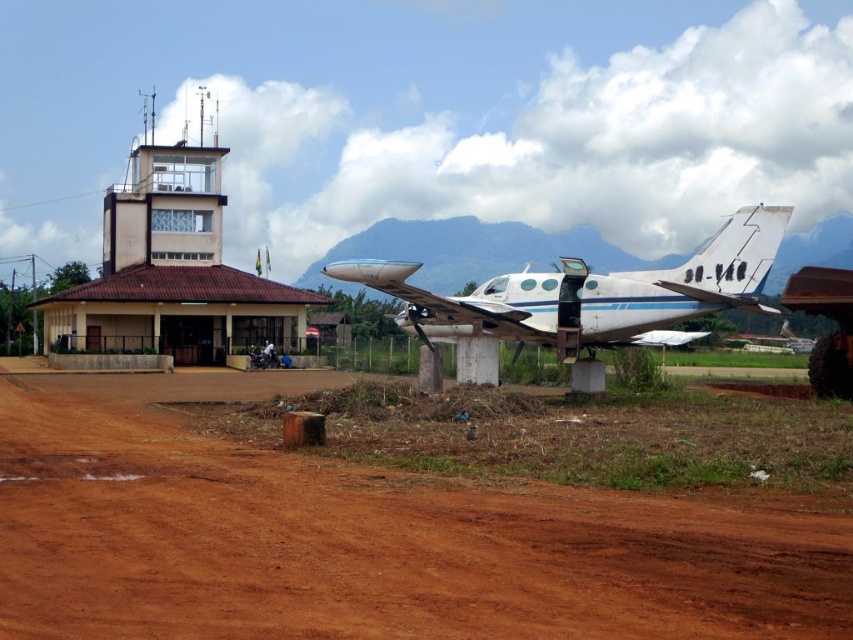
Question: Is brown dirt field at lower center positioned at the back of white matte airplane at center?

Choices:
 (A) yes
 (B) no

Answer: (B)

Question: Considering the relative positions of brown dirt field at lower center and white matte airplane at center in the image provided, where is brown dirt field at lower center located with respect to white matte airplane at center?

Choices:
 (A) below
 (B) above

Answer: (A)

Question: Which object is farther from the camera taking this photo?

Choices:
 (A) brown dirt field at lower center
 (B) white matte airplane at center

Answer: (B)

Question: Which point is closer to the camera taking this photo?

Choices:
 (A) (323, 625)
 (B) (757, 221)

Answer: (A)

Question: Does brown dirt field at lower center appear on the left side of white matte airplane at center?

Choices:
 (A) no
 (B) yes

Answer: (B)